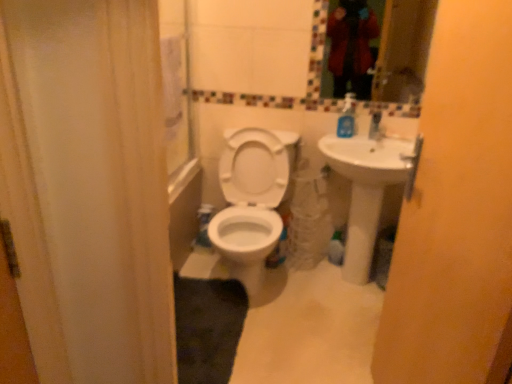
Question: From the image's perspective, is blue plastic soap dispenser at upper right below white glossy toilet at center?

Choices:
 (A) yes
 (B) no

Answer: (B)

Question: Does blue plastic soap dispenser at upper right have a larger size compared to white glossy toilet at center?

Choices:
 (A) no
 (B) yes

Answer: (A)

Question: Can you confirm if blue plastic soap dispenser at upper right is taller than white glossy toilet at center?

Choices:
 (A) yes
 (B) no

Answer: (B)

Question: From a real-world perspective, is blue plastic soap dispenser at upper right beneath white glossy toilet at center?

Choices:
 (A) no
 (B) yes

Answer: (A)

Question: Is blue plastic soap dispenser at upper right far from white glossy toilet at center?

Choices:
 (A) no
 (B) yes

Answer: (A)

Question: Does blue plastic soap dispenser at upper right have a smaller size compared to white glossy toilet at center?

Choices:
 (A) yes
 (B) no

Answer: (A)

Question: Is white glossy sink at right at the right side of matte yellow screen door at right?

Choices:
 (A) yes
 (B) no

Answer: (A)

Question: From the image's perspective, is white glossy sink at right on matte yellow screen door at right?

Choices:
 (A) no
 (B) yes

Answer: (B)

Question: Considering the relative sizes of white glossy sink at right and matte yellow screen door at right in the image provided, is white glossy sink at right thinner than matte yellow screen door at right?

Choices:
 (A) no
 (B) yes

Answer: (A)

Question: Is white glossy sink at right aimed at matte yellow screen door at right?

Choices:
 (A) no
 (B) yes

Answer: (B)

Question: Is white glossy sink at right next to matte yellow screen door at right and touching it?

Choices:
 (A) yes
 (B) no

Answer: (B)

Question: From a real-world perspective, is white glossy sink at right located higher than matte yellow screen door at right?

Choices:
 (A) no
 (B) yes

Answer: (A)

Question: Is matte yellow screen door at right taller than glassy mosaic mirror at upper center?

Choices:
 (A) no
 (B) yes

Answer: (B)